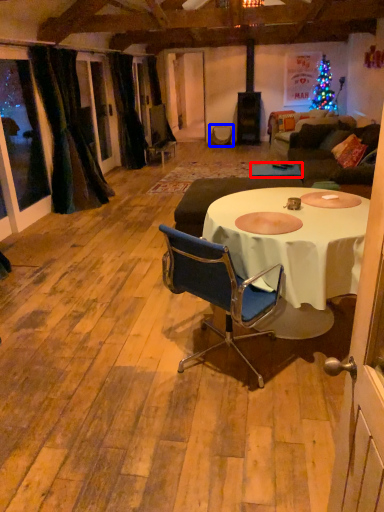
Question: Which point is closer to the camera, table (highlighted by a red box) or armchair (highlighted by a blue box)?

Choices:
 (A) table
 (B) armchair

Answer: (A)